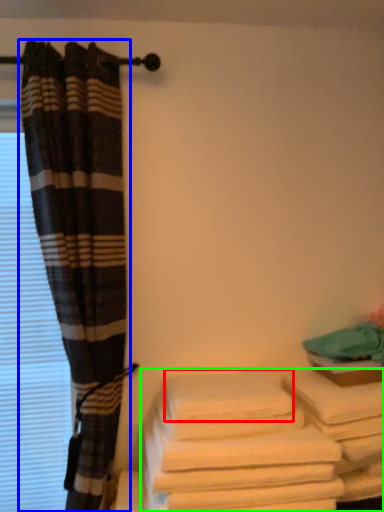
Question: Which object is positioned closest to bath towel (highlighted by a red box)? Select from curtain (highlighted by a blue box) and towel (highlighted by a green box).

Choices:
 (A) curtain
 (B) towel

Answer: (B)